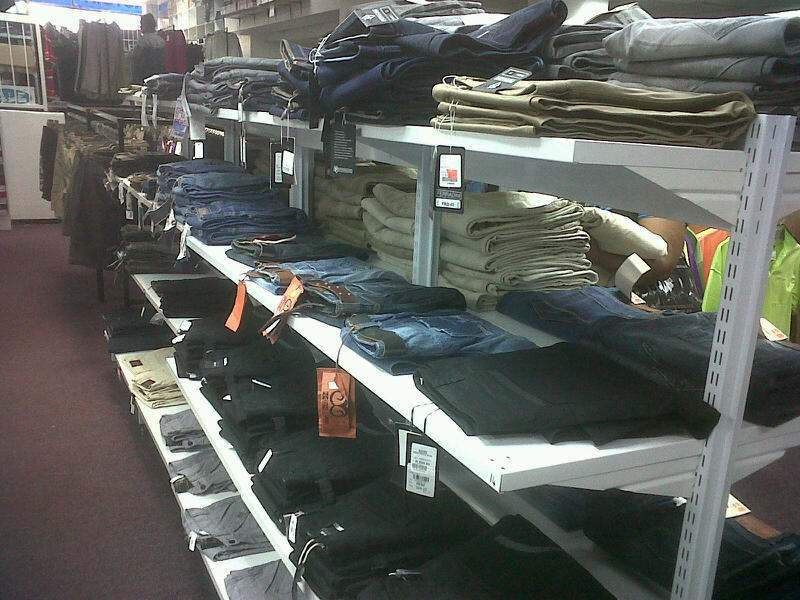
This screenshot has width=800, height=600. I want to click on bar filled with hangers and shorts, so click(x=117, y=134).